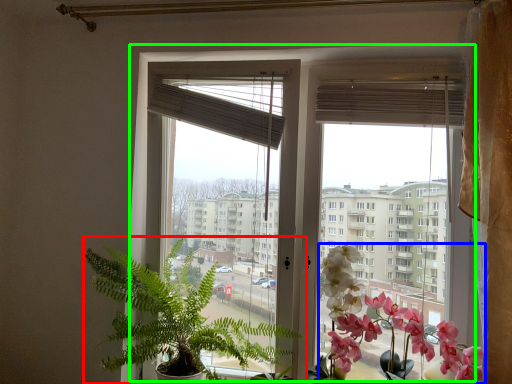
Question: Which object is positioned farthest from houseplant (highlighted by a red box)? Select from flower (highlighted by a blue box) and window (highlighted by a green box).

Choices:
 (A) flower
 (B) window

Answer: (A)